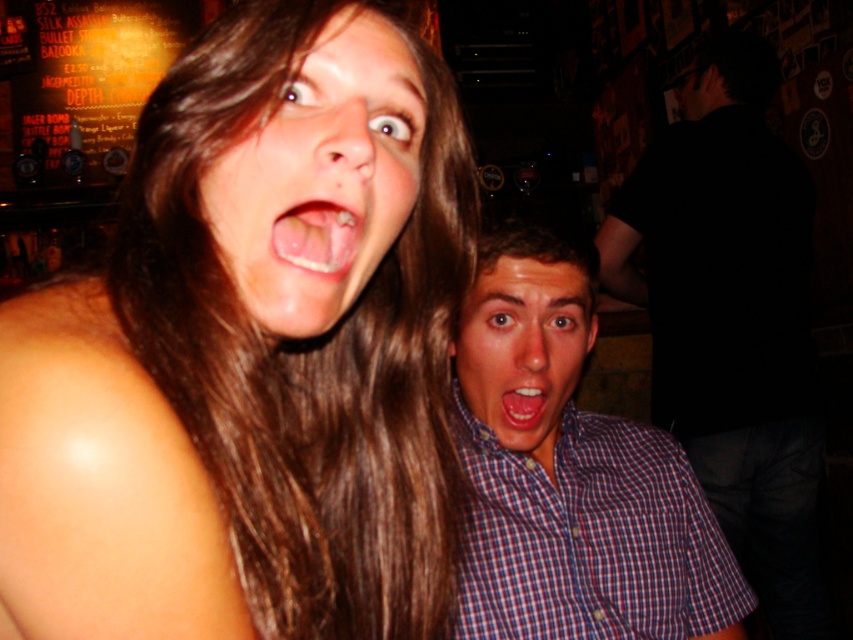
Question: Does brown hair at upper left have a lesser width compared to white glossy tongue at center?

Choices:
 (A) yes
 (B) no

Answer: (B)

Question: Is brown hair at center to the right of matte pink lips at center from the viewer's perspective?

Choices:
 (A) no
 (B) yes

Answer: (A)

Question: Which of these objects is positioned closest to the black shirt at right?

Choices:
 (A) blue plaid shirt at right
 (B) white glossy tongue at center
 (C) brown hair at upper left

Answer: (A)

Question: Does black shirt at right appear under white glossy tongue at center?

Choices:
 (A) yes
 (B) no

Answer: (A)

Question: Which object is the farthest from the brown hair at center?

Choices:
 (A) blue plaid shirt at right
 (B) white glossy tongue at center

Answer: (A)

Question: Which object appears farthest from the camera in this image?

Choices:
 (A) matte pink lips at center
 (B) blue plaid shirt at right
 (C) white glossy tongue at center
 (D) brown hair at center

Answer: (A)